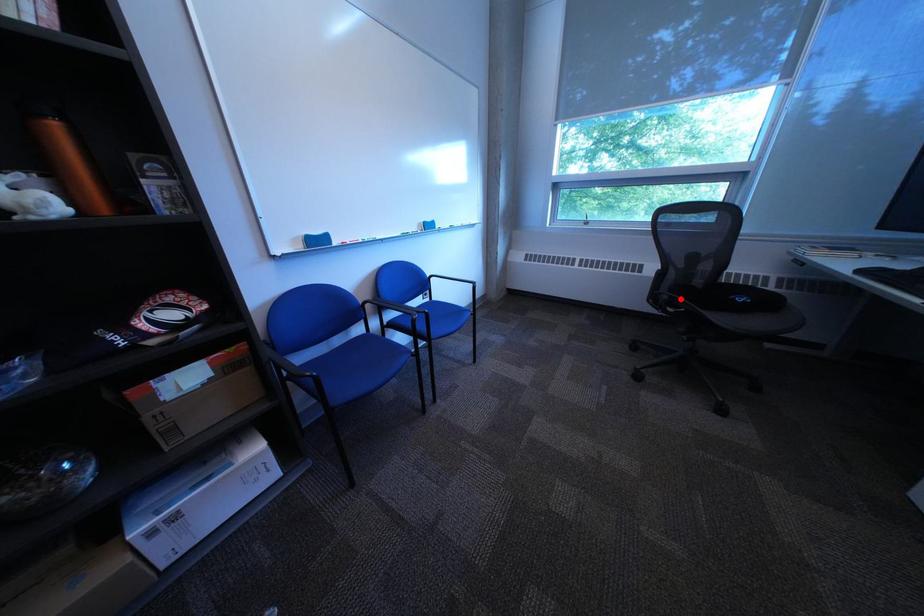
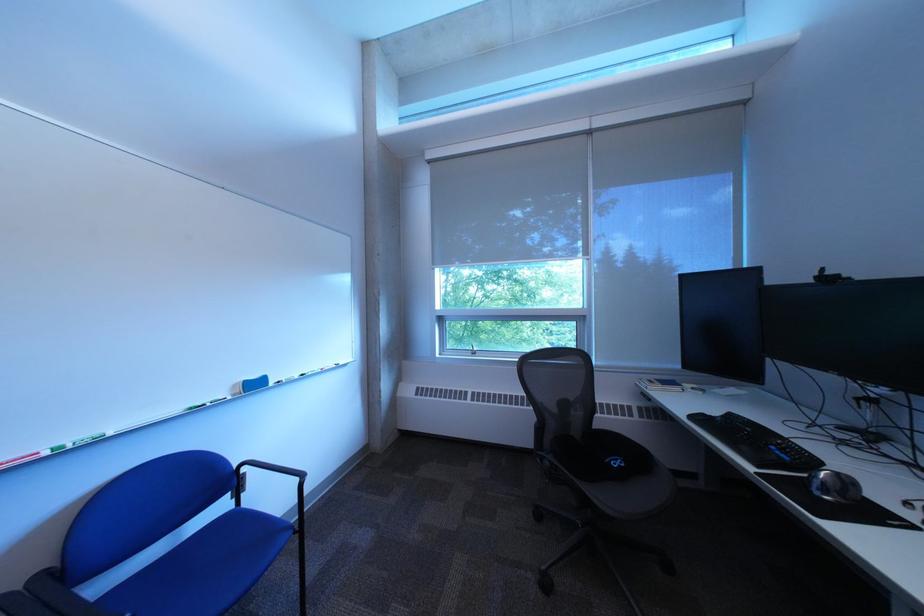
Find the pixel in the second image that matches the highlighted location in the first image.

(563, 464)